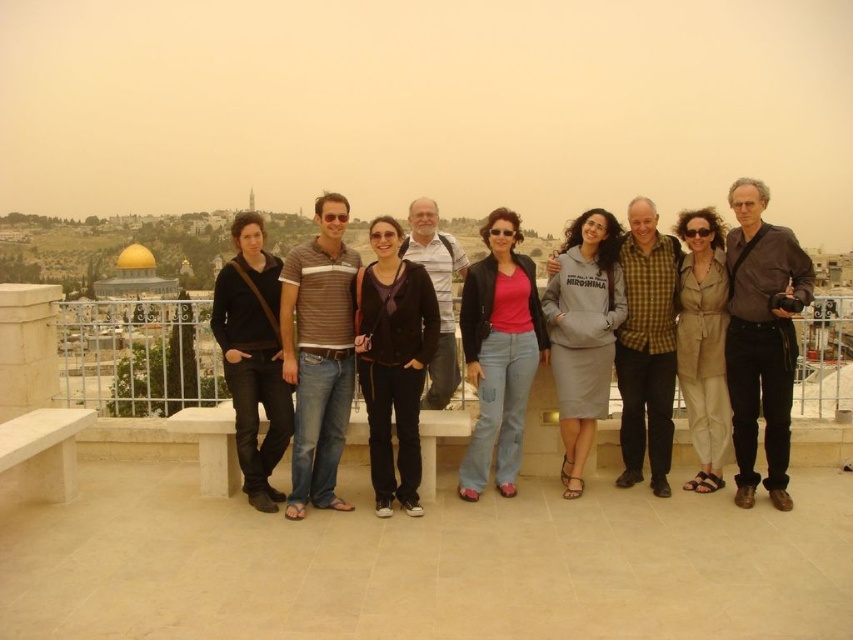
You are a photographer trying to adjust the focus on your camera to capture both the dark gray shirt at center and the striped polo shirt at center in the same frame. Which person should you focus on first to ensure both are in focus?

You should focus on the dark gray shirt at center first because it is smaller in size compared to the striped polo shirt at center, so adjusting focus starting from the closer or smaller object ensures both are in focus.

You are a photographer trying to adjust the lighting for a group photo. You notice the pink matte shirt at center and the black matte jacket at center. Which clothing item is positioned higher relative to the other in the image?

The pink matte shirt at center is above the black matte jacket at center, so it is positioned higher.

In the scene shown: You are a photographer trying to adjust the lighting for the group photo. Since the pink matte shirt at center and the black matte jacket at center are both at the center, which one might require more light adjustment due to its size?

The black matte jacket at center requires more light adjustment because it occupies more space than the pink matte shirt at center, so it needs proper lighting to capture its details accurately.